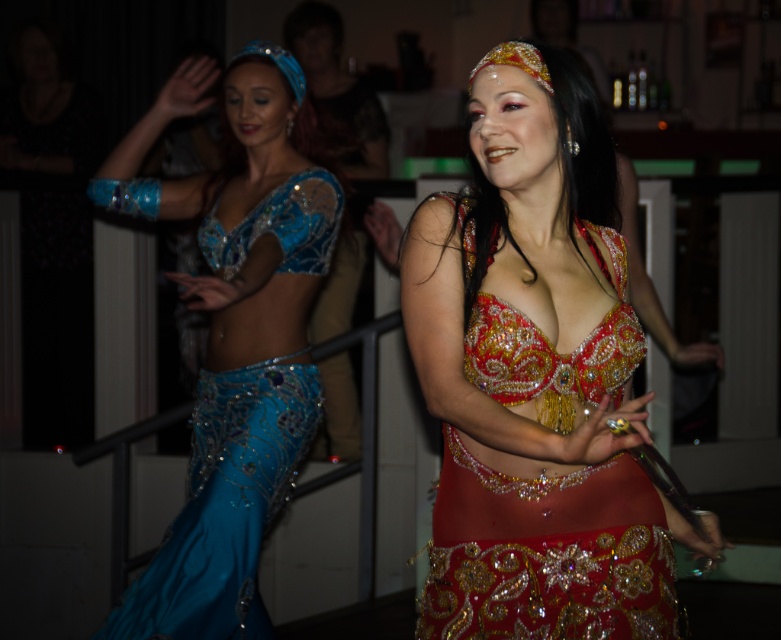
Does point (473, 170) come farther from viewer compared to point (262, 84)?

No, it is not.

Is point (653, 614) less distant than point (127, 618)?

That is True.

This screenshot has height=640, width=781. Identify the location of shiny sequined costume at center. (537, 376).